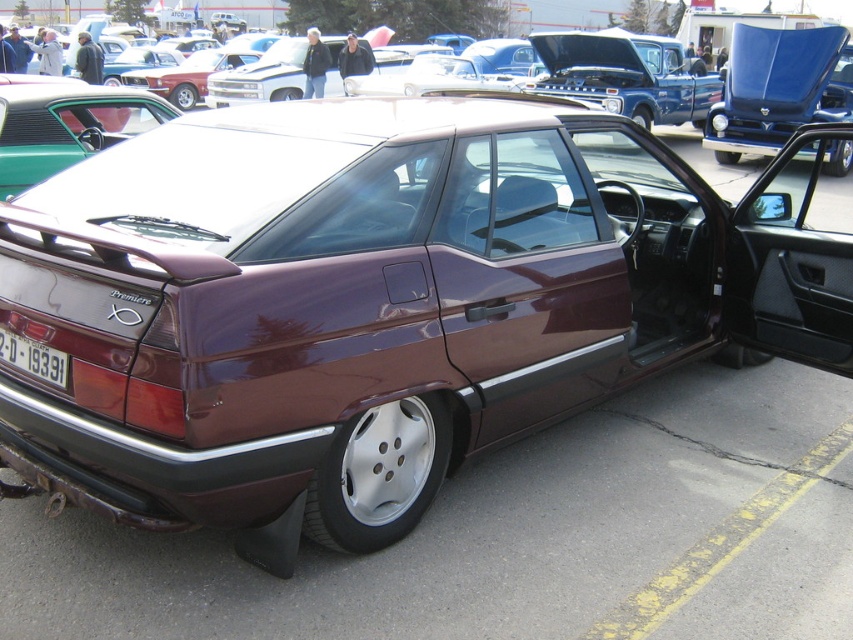
Question: Observing the image, what is the correct spatial positioning of shiny blue hood at upper right in reference to white plastic license plate at rear?

Choices:
 (A) left
 (B) right

Answer: (B)

Question: Which of the following is the closest to the observer?

Choices:
 (A) (663, 48)
 (B) (790, 116)
 (C) (30, 352)

Answer: (C)

Question: Which is farther from the satin burgundy sedan at center?

Choices:
 (A) white plastic license plate at rear
 (B) shiny blue hood at upper right

Answer: (A)

Question: Which point is farther from the camera taking this photo?

Choices:
 (A) (743, 36)
 (B) (636, 83)
 (C) (55, 358)

Answer: (B)

Question: Is shiny blue hood at upper right positioned at the back of satin burgundy sedan at center?

Choices:
 (A) no
 (B) yes

Answer: (A)

Question: Is shiny blue hood at upper right smaller than satin burgundy sedan at center?

Choices:
 (A) no
 (B) yes

Answer: (B)